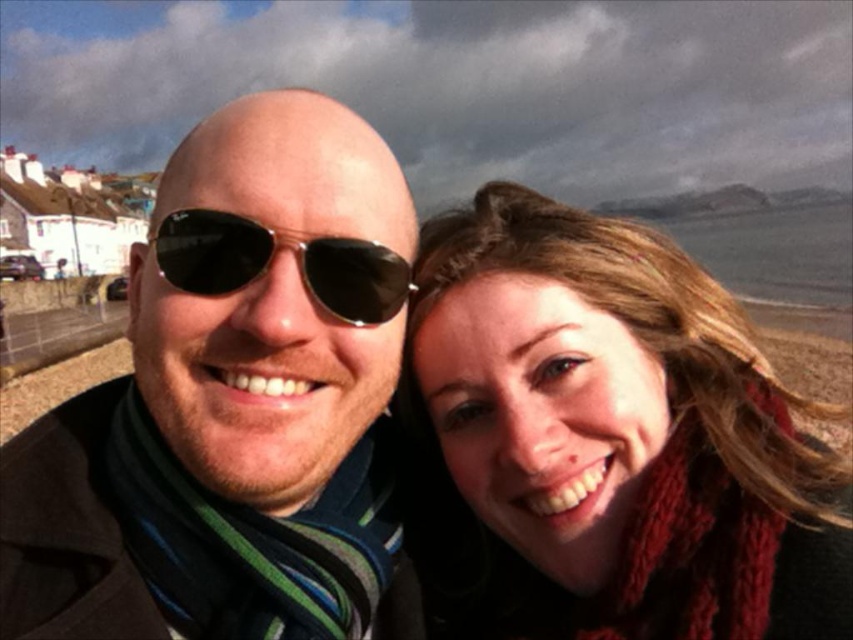
You are trying to locate the matte black sunglasses at center in the image. According to the coordinates provided, where exactly would you find them?

The matte black sunglasses at center are located at point 0.634 on the x axis and 0.275 on the y axis.

You are a photographer trying to focus on the black reflective sunglasses at center in the image. However, the knitted red scarf at right is blocking your view. Can you adjust your position so that the sunglasses become visible without the scarf obscuring them?

The knitted red scarf at right is in front of the black reflective sunglasses at center, so moving your position to the left might allow you to see the sunglasses without the scarf blocking the view.